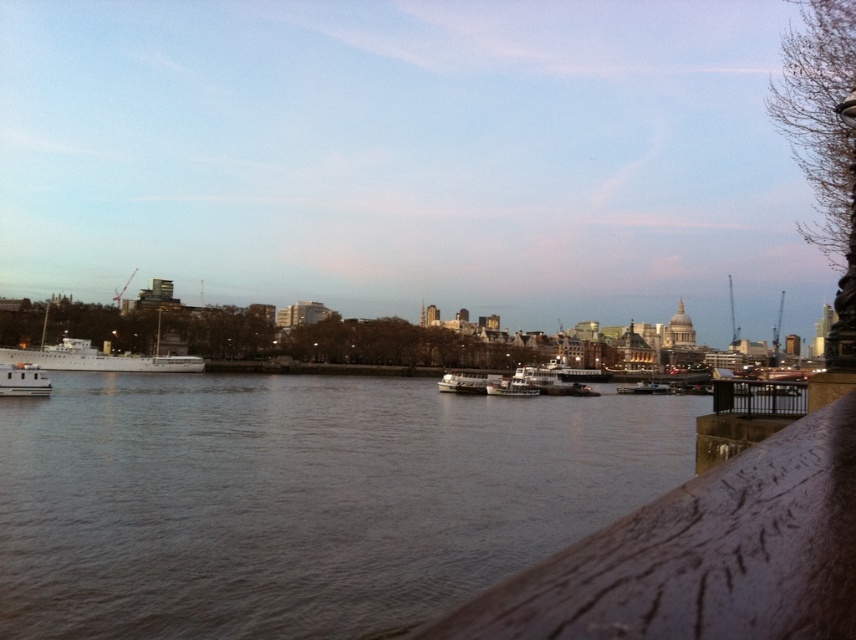
Can you confirm if brown wooden rail at lower right is positioned to the left of metallic silver boat at center?

Correct, you'll find brown wooden rail at lower right to the left of metallic silver boat at center.

The width and height of the screenshot is (856, 640). Find the location of `brown wooden rail at lower right`. brown wooden rail at lower right is located at coordinates (702, 556).

Which of these two, brown water at center or metallic silver boat at center, stands taller?

brown water at center

Is the position of brown water at center more distant than that of metallic silver boat at center?

No, it is in front of metallic silver boat at center.

Image resolution: width=856 pixels, height=640 pixels. Find the location of `brown water at center`. brown water at center is located at coordinates (301, 499).

Does brown wooden rail at lower right have a greater width compared to white matte ship at left?

In fact, brown wooden rail at lower right might be narrower than white matte ship at left.

Does brown wooden rail at lower right appear on the right side of white matte ship at left?

Yes, brown wooden rail at lower right is to the right of white matte ship at left.

Is point (789, 451) positioned in front of point (108, 369)?

Yes, point (789, 451) is in front of point (108, 369).

Locate an element on the screen. brown wooden rail at lower right is located at coordinates (702, 556).